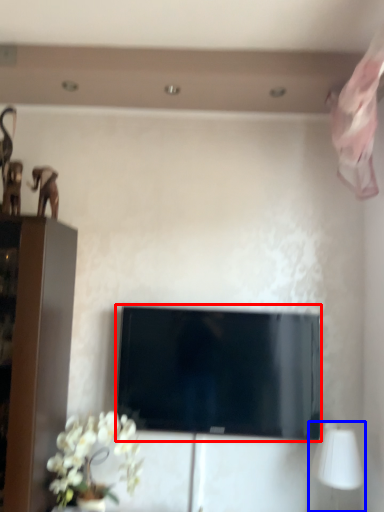
Question: Which of the following is the closest to the observer, television (highlighted by a red box) or table lamp (highlighted by a blue box)?

Choices:
 (A) television
 (B) table lamp

Answer: (B)